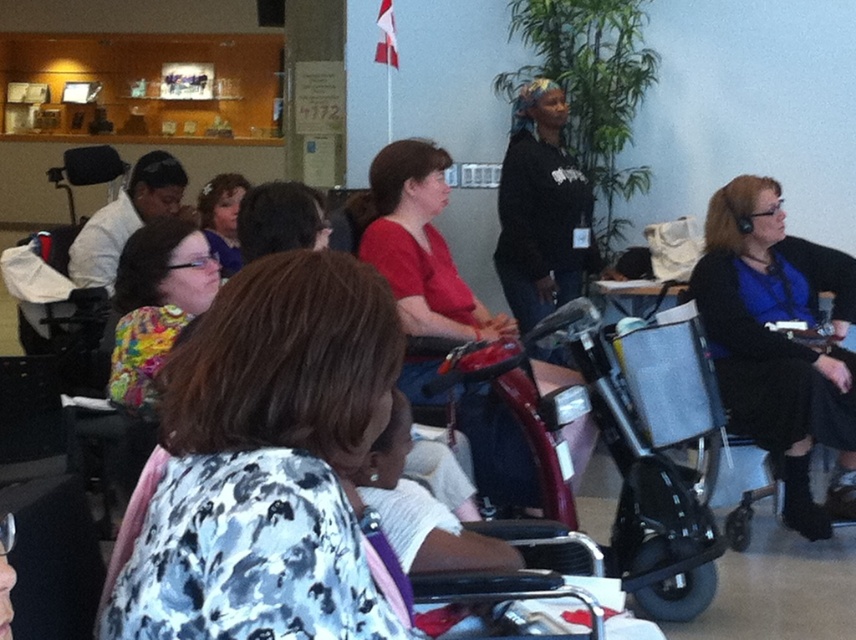
You are a service robot in a public waiting area. You need to move to the exit located at the back of the room. There is a matte black wheelchair at right in your path. Can you navigate around it without obstacles?

The matte black wheelchair at right is located at point (779,342), so yes, the robot can navigate around it as long as there are no other obstacles in the path.

You are a visitor in this waiting area and need to locate the metallic red mobility scooter at center. According to the coordinates provided, where would you find it?

The metallic red mobility scooter at center is located at coordinates point [638,444].